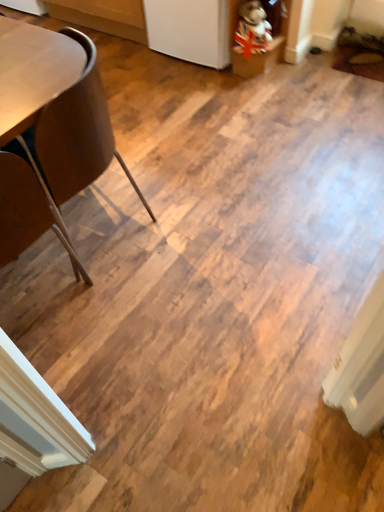
Question: Considering the positions of union jack plush at upper right and brown leather chair at left, positioned as the 2th chair in bottom-to-top order, in the image, is union jack plush at upper right taller or shorter than brown leather chair at left, positioned as the 2th chair in bottom-to-top order,?

Choices:
 (A) tall
 (B) short

Answer: (B)

Question: From a real-world perspective, is union jack plush at upper right physically located above or below brown leather chair at left, which is counted as the 1th chair, starting from the top?

Choices:
 (A) above
 (B) below

Answer: (B)

Question: Estimate the real-world distances between objects in this image. Which object is farther from the brown leather chair at left, which is counted as the 1th chair, starting from the top?

Choices:
 (A) brown leather chair at left, acting as the 2th chair starting from the top
 (B) union jack plush at upper right

Answer: (B)

Question: Which object is positioned farthest from the brown leather chair at left, acting as the 2th chair starting from the top?

Choices:
 (A) union jack plush at upper right
 (B) brown leather chair at left, which is counted as the 1th chair, starting from the top

Answer: (A)